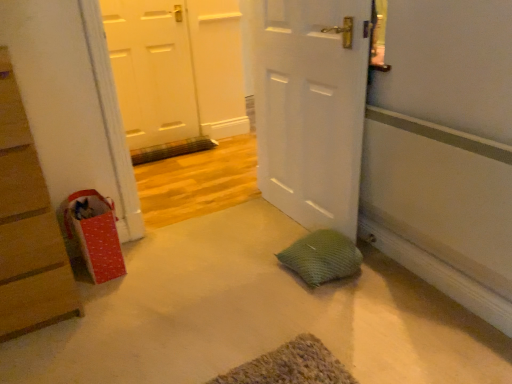
In order to click on vacant area that is situated to the right of wooden vent at center in this screenshot , I will do `click(224, 159)`.